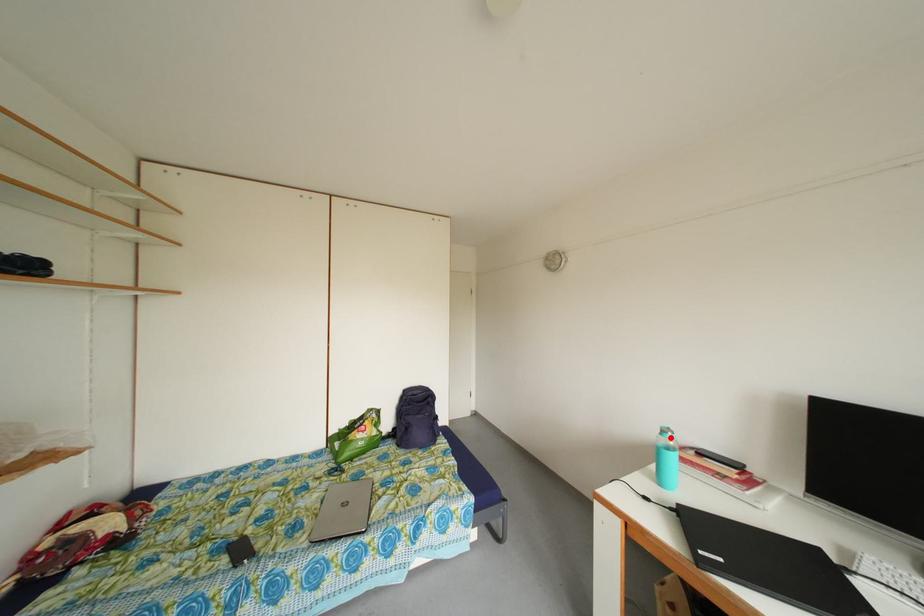
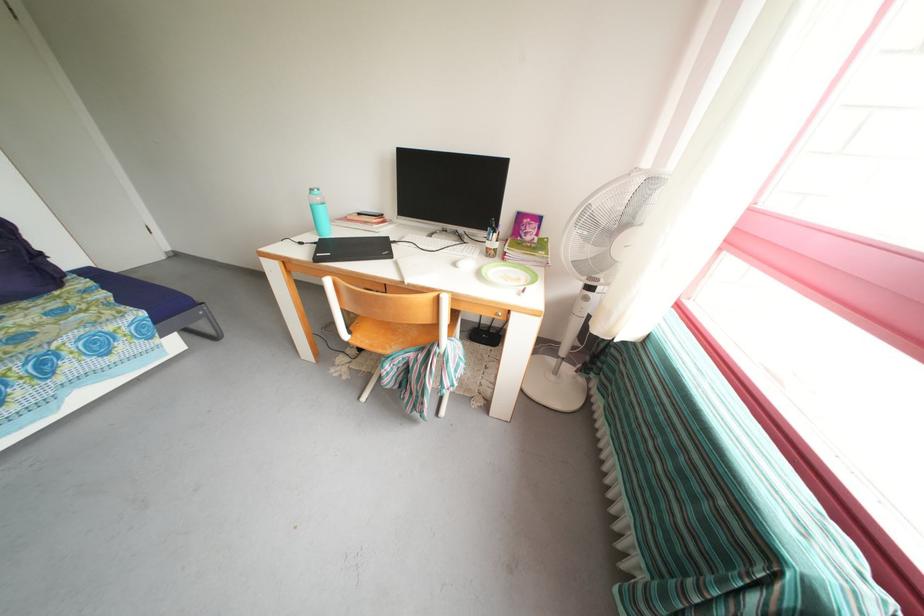
The point at the highlighted location is marked in the first image. Where is the corresponding point in the second image?

(319, 196)